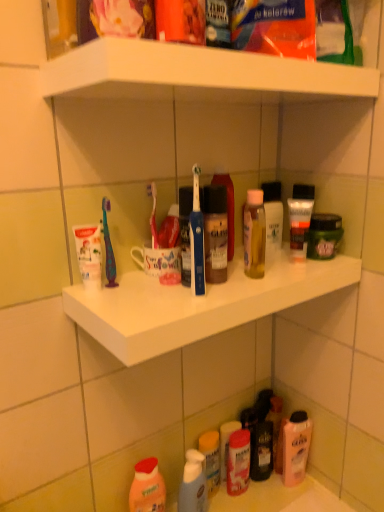
The width and height of the screenshot is (384, 512). Identify the location of free location to the right of blue plastic toothbrush at center. (254, 286).